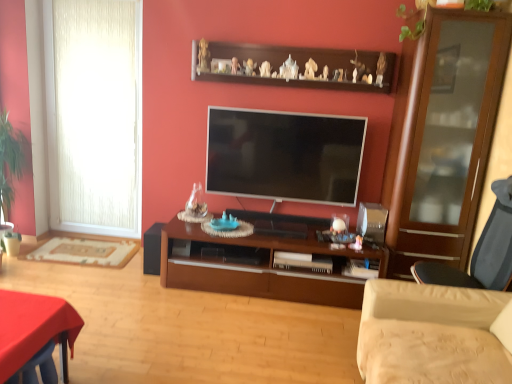
The width and height of the screenshot is (512, 384). In order to click on vacant space in front of brown wood cabinet at center in this screenshot , I will do `click(246, 336)`.